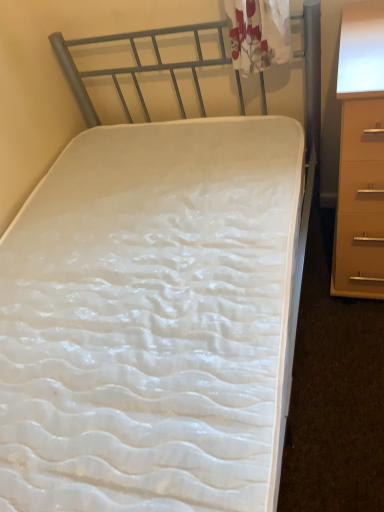
You are a GUI agent. You are given a task and a screenshot of the screen. Output one action in this format:
    pyautogui.click(x=<x>, y=<y>)
    Task: Click on the free space above beige wood chest of drawers at right (from a real-world perspective)
    The width and height of the screenshot is (384, 512).
    Given the screenshot: What is the action you would take?
    pyautogui.click(x=362, y=41)